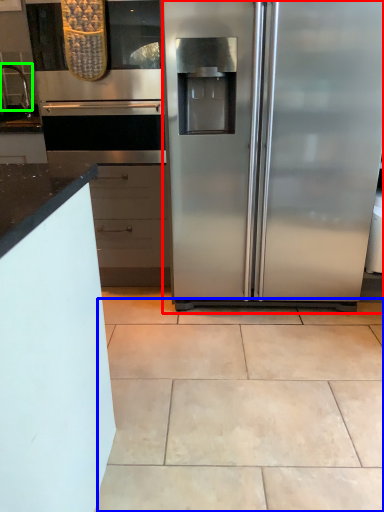
Question: Which object is positioned farthest from refrigerator (highlighted by a red box)? Select from ceramic tile (highlighted by a blue box) and faucet (highlighted by a green box).

Choices:
 (A) ceramic tile
 (B) faucet

Answer: (B)